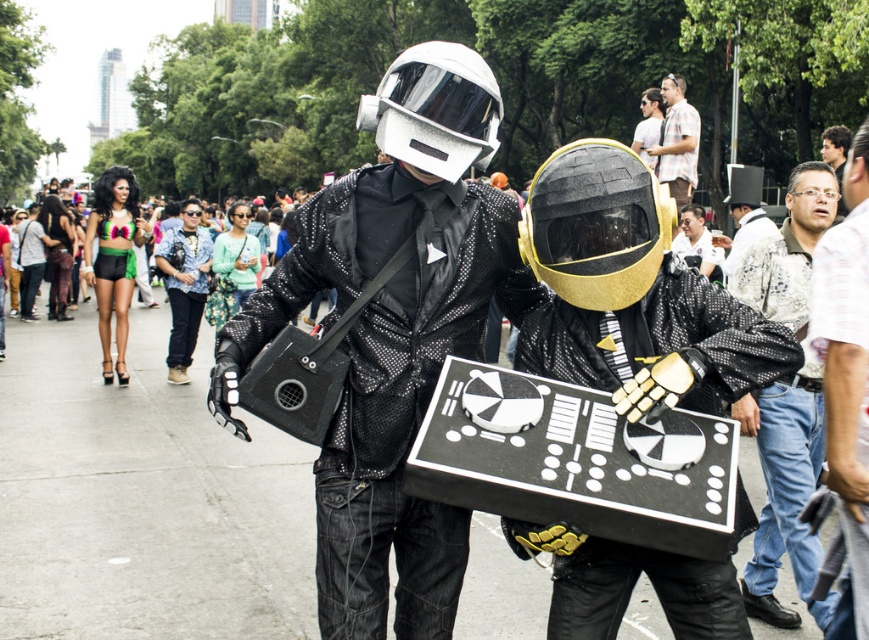
Based on the photo, you are at a costume party and need to decide which item to take first. The green shiny shorts at center and the white textured top hat at upper center are both on a rack. If you can only carry one item at a time, which item would be easier to carry because it is narrower?

The green shiny shorts at center is narrower than the white textured top hat at upper center, so it would be easier to carry.

You are at a costume party and see two matte black helmets in the scene. Which one is thinner? The matte black helmet at center or the matte black helmet at upper center?

The matte black helmet at center is thinner than the matte black helmet at upper center.

Based on the photo, you are a photographer standing at the center of the scene. You want to take a photo that includes both the light brown leather jacket at right and the matte black helmet at upper center. Given that your camera has a maximum zoom range of 10 meters, can you capture both objects in a single frame without moving?

The distance between the light brown leather jacket at right and the matte black helmet at upper center is 10.35 meters. Since the camera can only zoom up to 10 meters, the photographer cannot capture both objects in a single frame without moving.